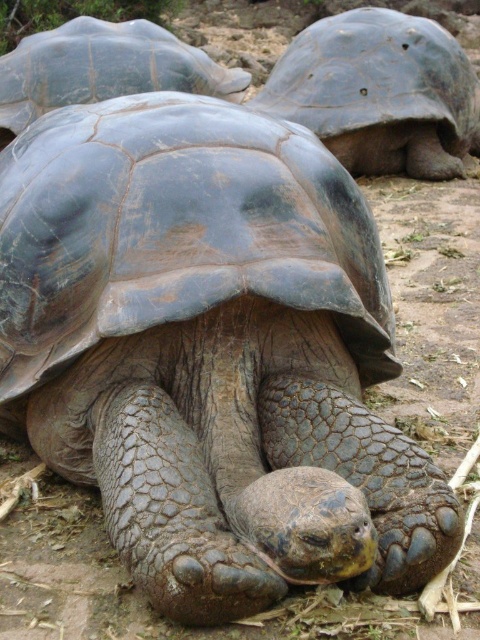
You are a wildlife photographer aiming to capture a photo of the leathery gray tortoise at upper right and the smooth gray tortoise at center. Your camera can only focus on objects within a 30 inch range. Can you fit both tortoises into the frame without moving the camera?

The leathery gray tortoise at upper right and smooth gray tortoise at center are 29.25 inches apart from each other. Since the distance between them is less than the camera focus range of 30 inches, you can fit both tortoises into the frame without moving the camera.